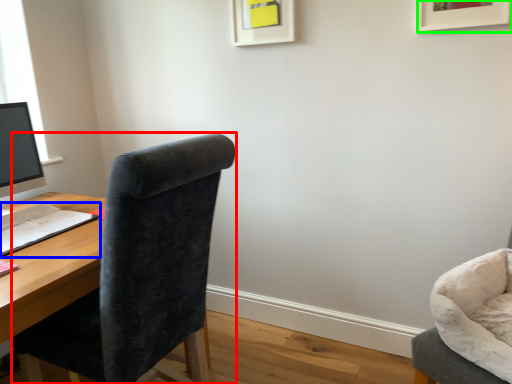
Question: Considering the real-world distances, which object is farthest from chair (highlighted by a red box)? notepad (highlighted by a blue box) or picture frame (highlighted by a green box)?

Choices:
 (A) notepad
 (B) picture frame

Answer: (B)